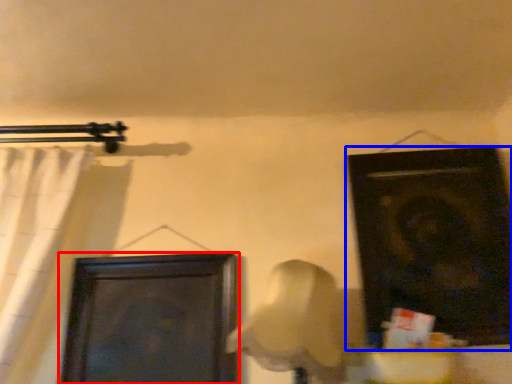
Question: Which object is closer to the camera taking this photo, door (highlighted by a red box) or door (highlighted by a blue box)?

Choices:
 (A) door
 (B) door

Answer: (B)